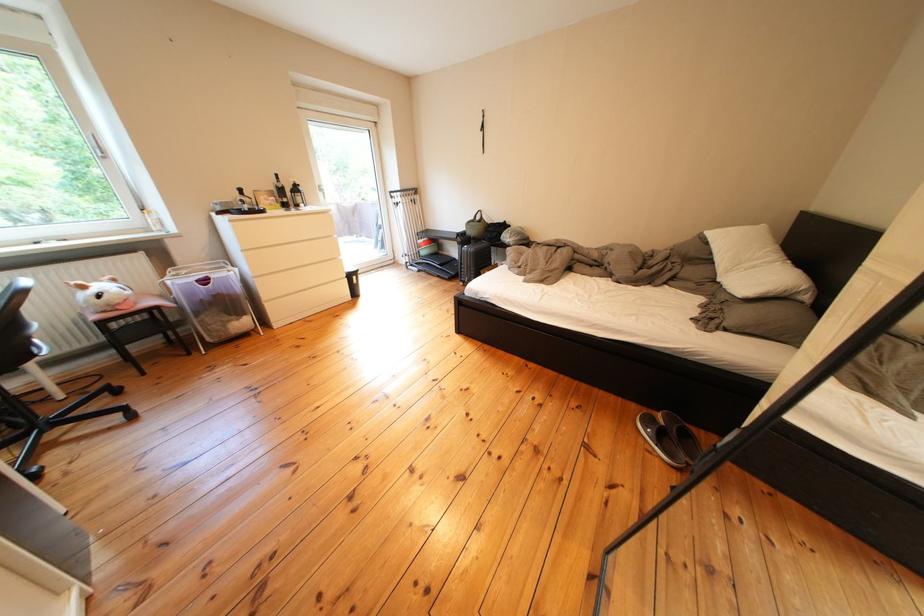
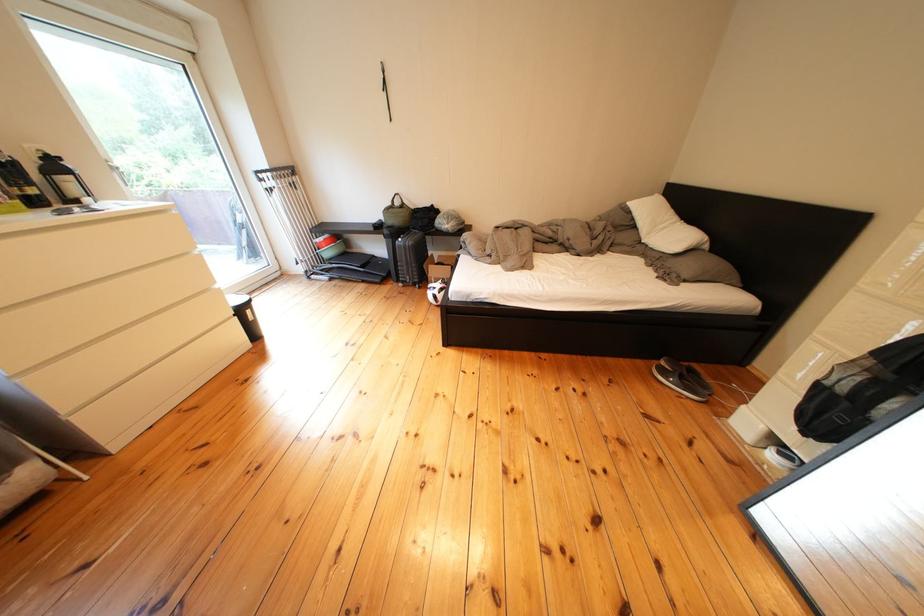
Question: The first image is from the beginning of the video and the second image is from the end. How did the camera likely rotate when shooting the video?

Choices:
 (A) Left
 (B) Right
 (C) Up
 (D) Down

Answer: (B)